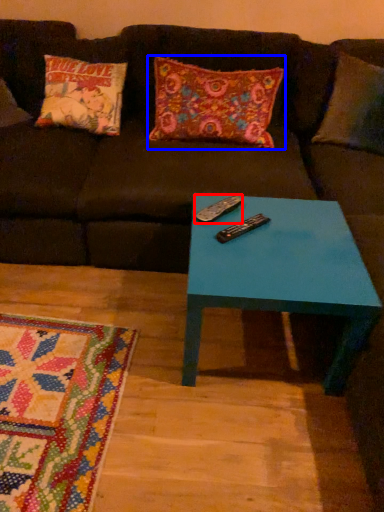
Question: Among these objects, which one is farthest to the camera, remote (highlighted by a red box) or pillow (highlighted by a blue box)?

Choices:
 (A) remote
 (B) pillow

Answer: (B)